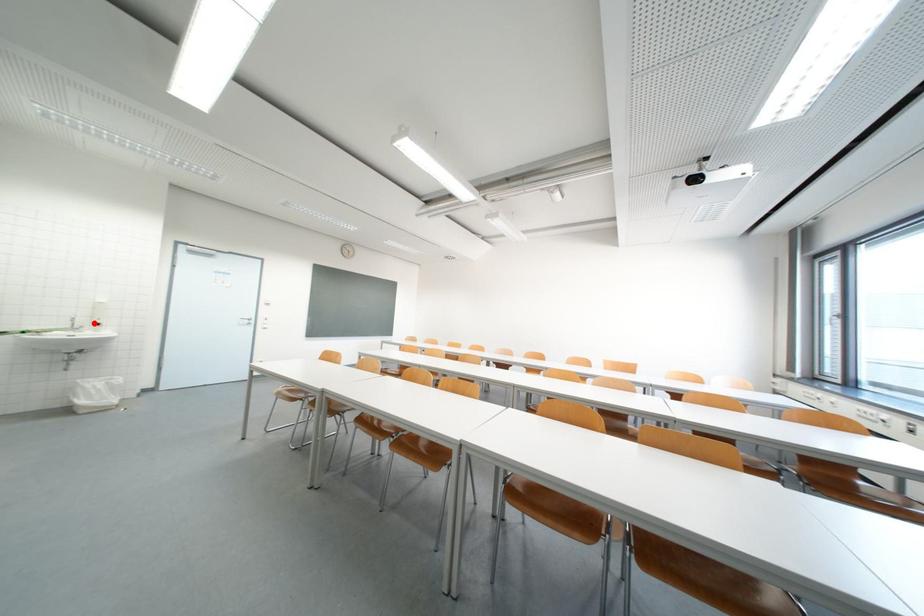
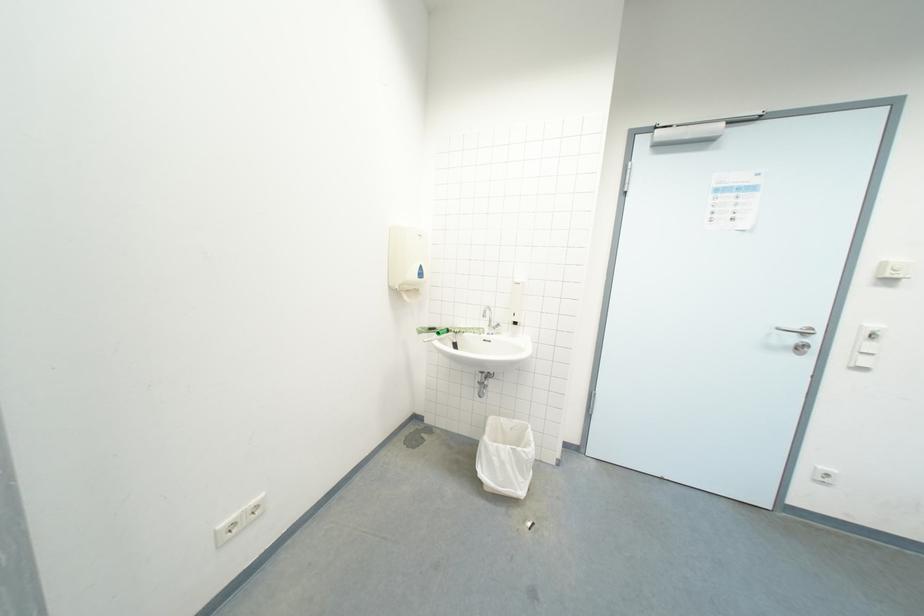
Find the pixel in the second image that matches the highlighted location in the first image.

(511, 318)